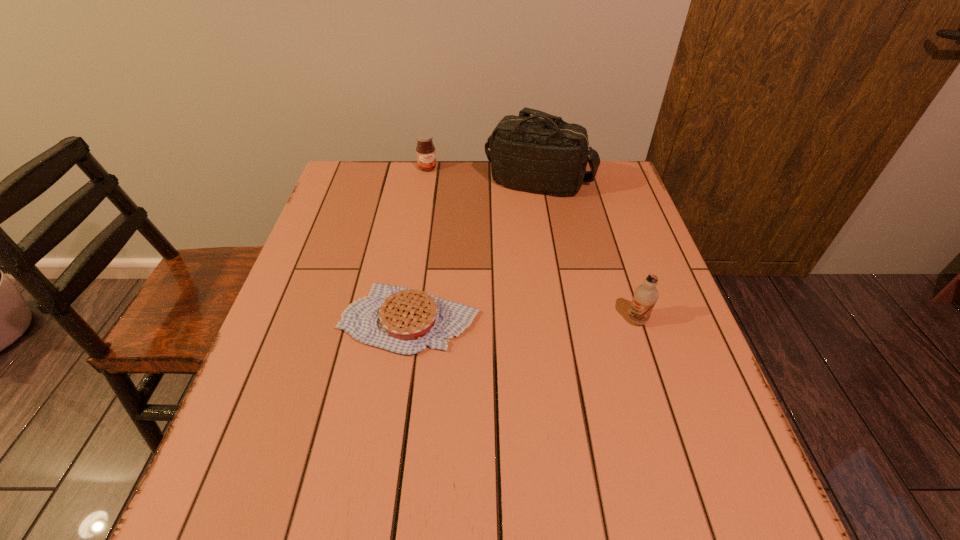
Find the location of `pie`. pie is located at coordinates (398, 319).

Identify the location of chocolate milk. The image size is (960, 540). (646, 295).

You are a GUI agent. You are given a task and a screenshot of the screen. Output one action in this format:
    pyautogui.click(x=<x>, y=<y>)
    Task: Click on the third tallest object
    
    Given the screenshot: What is the action you would take?
    pyautogui.click(x=425, y=150)

Locate an element on the screen. the tallest object is located at coordinates (549, 156).

Where is `free spot located on the back of the shortest object`? The image size is (960, 540). free spot located on the back of the shortest object is located at coordinates (423, 221).

Where is `vacant space located on the left of the chocolate milk`? The height and width of the screenshot is (540, 960). vacant space located on the left of the chocolate milk is located at coordinates (448, 320).

You are a GUI agent. You are given a task and a screenshot of the screen. Output one action in this format:
    pyautogui.click(x=<x>, y=<y>)
    Task: Click on the free region located 0.220m on the label side of the jam
    The width and height of the screenshot is (960, 540).
    Given the screenshot: What is the action you would take?
    click(448, 213)

This screenshot has height=540, width=960. What are the coordinates of `vacant region located 0.380m on the label side of the jam` in the screenshot? It's located at (466, 248).

Identify the location of vacant point located 0.320m on the label side of the jam. Image resolution: width=960 pixels, height=540 pixels. (459, 234).

You are a GUI agent. You are given a task and a screenshot of the screen. Output one action in this format:
    pyautogui.click(x=<x>, y=<y>)
    Task: Click on the vacant space located at the front padded panel of the shoulder bag
    This screenshot has width=960, height=540.
    Given the screenshot: What is the action you would take?
    pyautogui.click(x=547, y=293)